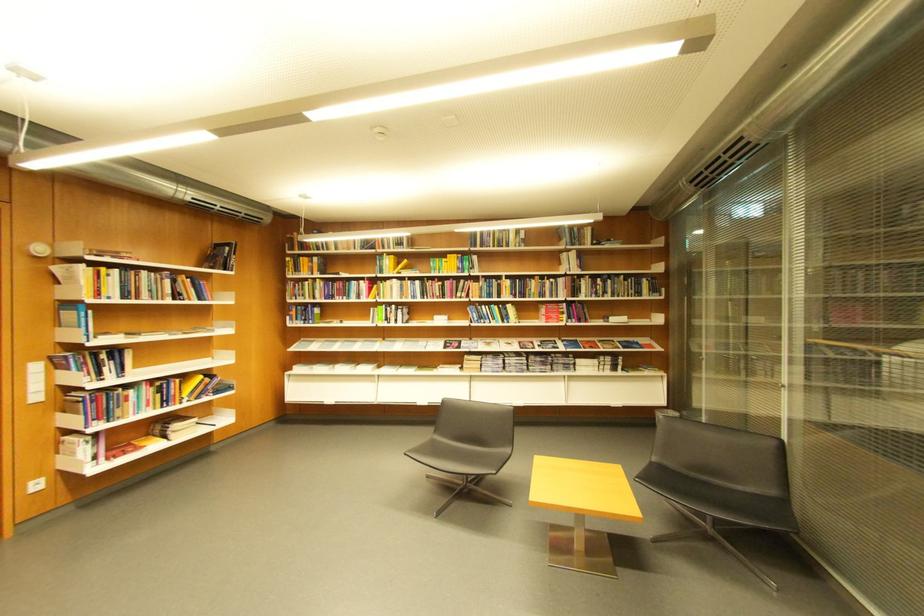
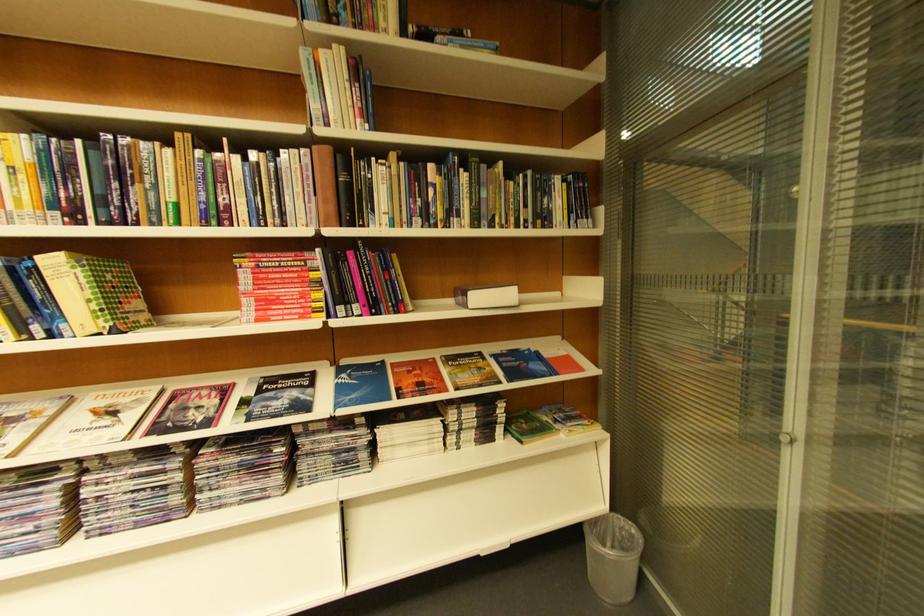
Question: I am providing you with two images of the same scene from different viewpoints. After the viewpoint changes to image2, which objects are now occluded?

Choices:
 (A) small white box
 (B) stacked magazine
 (C) grey trash can
 (D) none of these

Answer: (D)